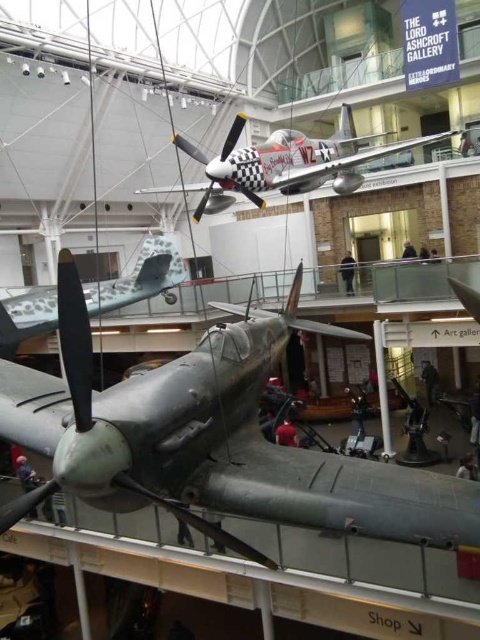
You are standing in the Lord Ashcroft Gallery and want to take a photo of the point at coordinates (x=460, y=547). Your camera has a maximum focus range of 4 meters. Will you be able to focus on that point?

The point at coordinates (x=460, y=547) is 4.36 meters away from the viewer. Since the camera can only focus up to 4 meters, it will not be able to focus on that point.

You are a visitor in the Lord Ashcroft Gallery and notice two airplanes displayed. The green matte airplane at center and the polished silver airplane at upper center. Which airplane is positioned higher in the image?

The polished silver airplane at upper center is positioned higher than the green matte airplane at center.

You are a museum visitor who wants to take a photo of the polished silver airplane at upper center and the camouflage paint airplane at center. Which airplane should you stand closer to in order to capture both in a single frame without zooming?

You should stand closer to the camouflage paint airplane at center because the polished silver airplane at upper center might be wider than the camouflage paint airplane at center, so positioning yourself nearer to the smaller one allows both to fit within the camera frame.